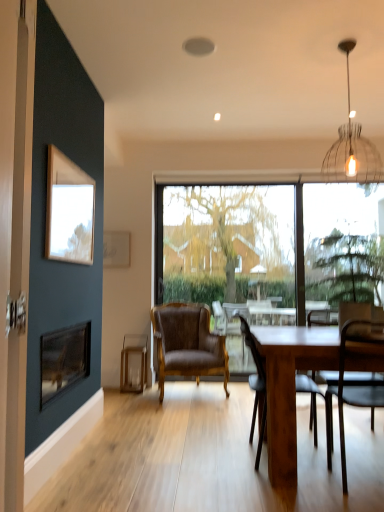
Question: Considering the relative positions of clear glass candlestick at lower center and wooden chair at center, the 2th chair positioned from the back, in the image provided, is clear glass candlestick at lower center to the left of wooden chair at center, the 2th chair positioned from the back, from the viewer's perspective?

Choices:
 (A) no
 (B) yes

Answer: (B)

Question: From a real-world perspective, is clear glass candlestick at lower center below wooden chair at center, which is the 2th chair from left to right?

Choices:
 (A) yes
 (B) no

Answer: (A)

Question: Can you confirm if clear glass candlestick at lower center is thinner than wooden chair at center, which is counted as the 2th chair, starting from the front?

Choices:
 (A) yes
 (B) no

Answer: (A)

Question: Is clear glass candlestick at lower center placed right next to wooden chair at center, the 2th chair positioned from the back?

Choices:
 (A) no
 (B) yes

Answer: (A)

Question: Would you consider clear glass candlestick at lower center to be distant from wooden chair at center, which appears as the 2th chair when viewed from the right?

Choices:
 (A) yes
 (B) no

Answer: (A)

Question: Is wooden table at center inside or outside of brown leather chair at center, positioned as the third chair in right-to-left order?

Choices:
 (A) outside
 (B) inside

Answer: (A)

Question: From a real-world perspective, is wooden table at center physically located above or below brown leather chair at center, the third chair viewed from the front?

Choices:
 (A) below
 (B) above

Answer: (A)

Question: Considering the positions of point (274, 462) and point (185, 357), is point (274, 462) closer or farther from the camera than point (185, 357)?

Choices:
 (A) closer
 (B) farther

Answer: (A)

Question: Relative to brown leather chair at center, positioned as the 1th chair in left-to-right order, is wooden table at center in front or behind?

Choices:
 (A) front
 (B) behind

Answer: (A)

Question: In the image, is green leafy tree at center, the 2th tree when ordered from back to front, on the left side or the right side of metallic dark brown chair at right, which is the third chair in left-to-right order?

Choices:
 (A) left
 (B) right

Answer: (B)

Question: Is point click(x=312, y=240) closer or farther from the camera than point click(x=339, y=415)?

Choices:
 (A) farther
 (B) closer

Answer: (A)

Question: In terms of height, does green leafy tree at center, which is the first tree from front to back, look taller or shorter compared to metallic dark brown chair at right, the 3th chair when ordered from back to front?

Choices:
 (A) tall
 (B) short

Answer: (B)

Question: Relative to metallic dark brown chair at right, which is the third chair in left-to-right order, is green leafy tree at center, which is the first tree from front to back, in front or behind?

Choices:
 (A) behind
 (B) front

Answer: (A)

Question: Choose the correct answer: Is clear glass candlestick at lower center inside wooden picture frame at upper left, which appears as the second picture frame when viewed from the back, or outside it?

Choices:
 (A) inside
 (B) outside

Answer: (B)

Question: From the image's perspective, is clear glass candlestick at lower center above or below wooden picture frame at upper left, which appears as the second picture frame when viewed from the back?

Choices:
 (A) below
 (B) above

Answer: (A)